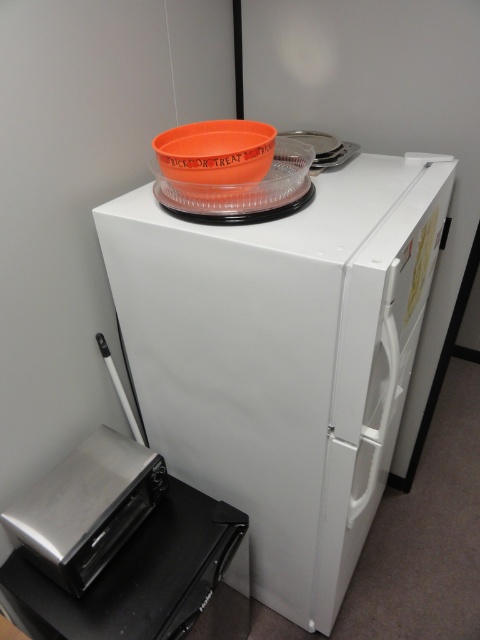
Question: Which object is farther from the camera taking this photo?

Choices:
 (A) orange matte bowl at upper center
 (B) white matte refrigerator at upper center

Answer: (A)

Question: Is white matte refrigerator at upper center smaller than orange matte bowl at upper center?

Choices:
 (A) yes
 (B) no

Answer: (B)

Question: Can you confirm if white matte refrigerator at upper center is positioned to the right of orange matte bowl at upper center?

Choices:
 (A) no
 (B) yes

Answer: (B)

Question: Which of the following is the closest to the observer?

Choices:
 (A) (316, 577)
 (B) (188, 140)

Answer: (B)

Question: Where is white matte refrigerator at upper center located in relation to orange matte bowl at upper center in the image?

Choices:
 (A) left
 (B) right

Answer: (B)